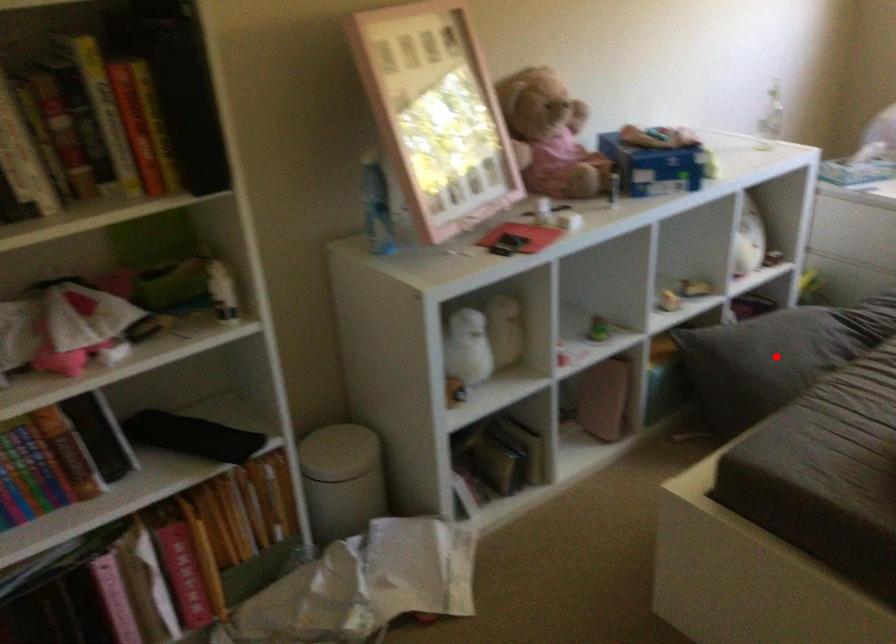
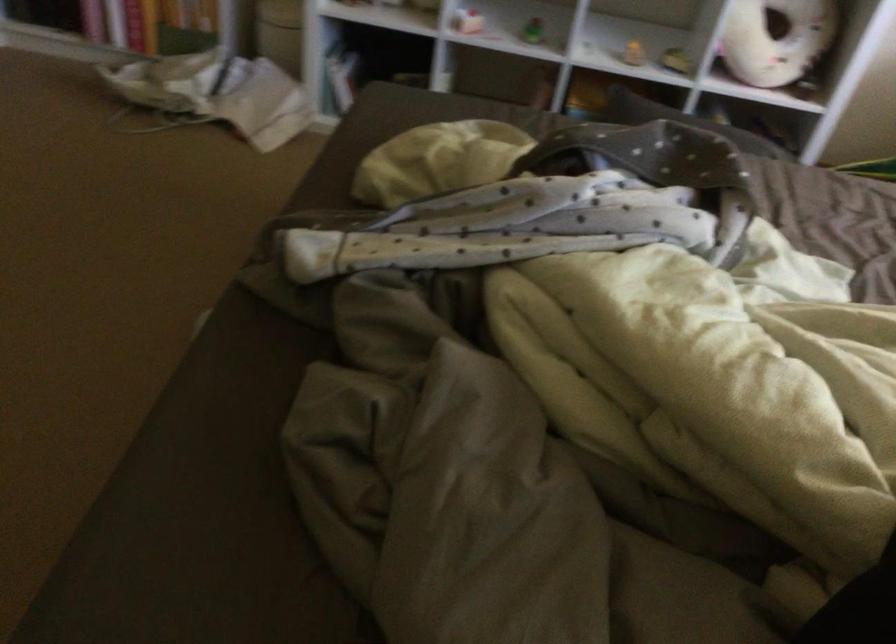
Question: I am providing you with two images of the same scene from different viewpoints. A red point is marked on the first image. Is the red point's position out of view in image 2?

Choices:
 (A) Yes
 (B) No

Answer: (A)